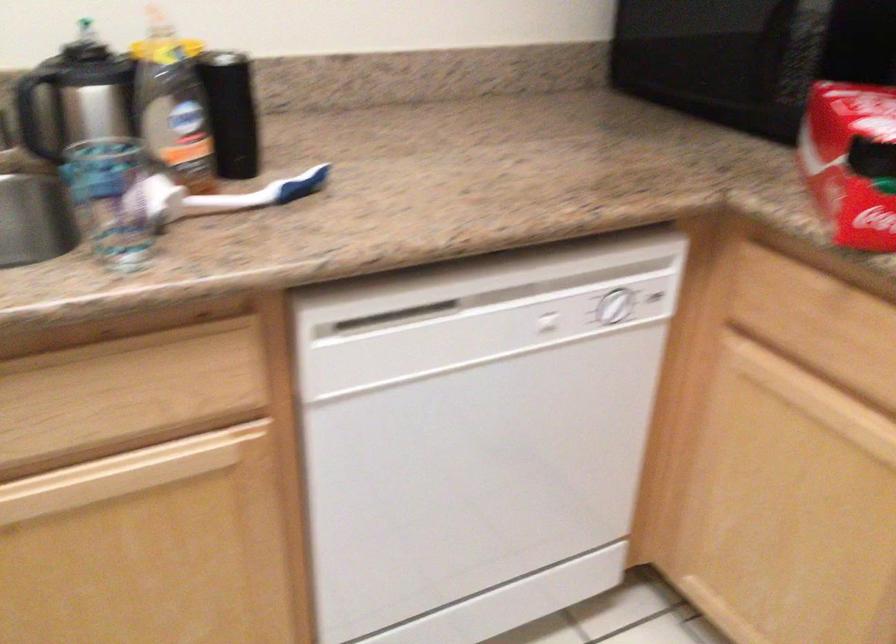
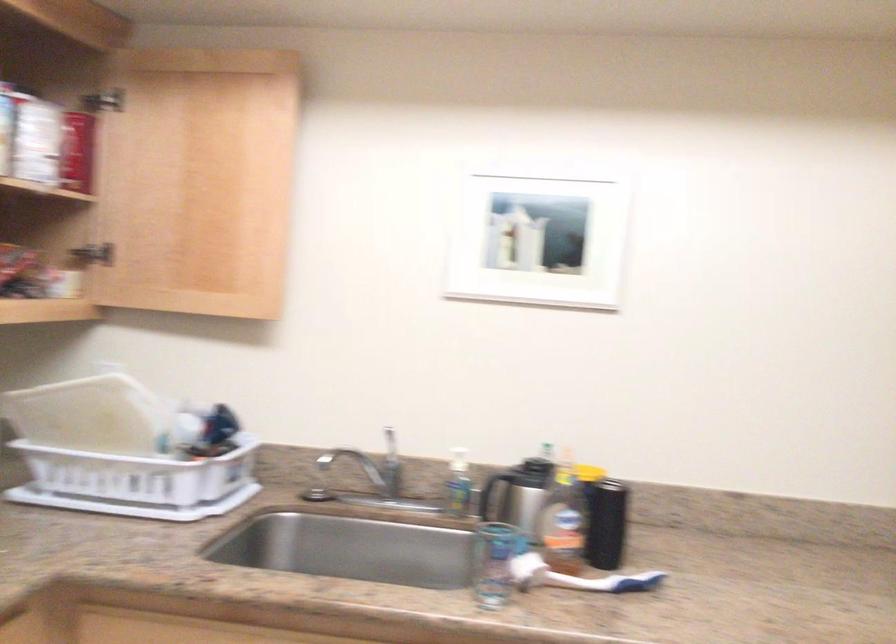
In the second image, find the point that corresponds to (x=504, y=174) in the first image.

(828, 621)